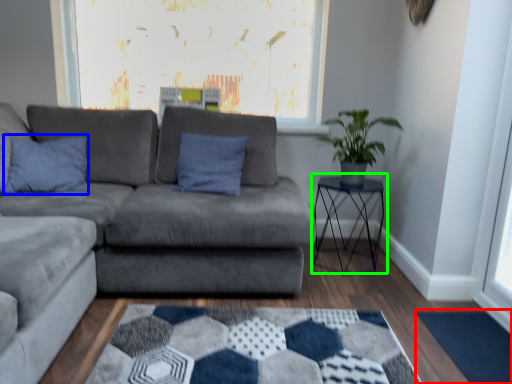
Question: Considering the real-world distances, which object is farthest from mat (highlighted by a red box)? pillow (highlighted by a blue box) or table (highlighted by a green box)?

Choices:
 (A) pillow
 (B) table

Answer: (A)